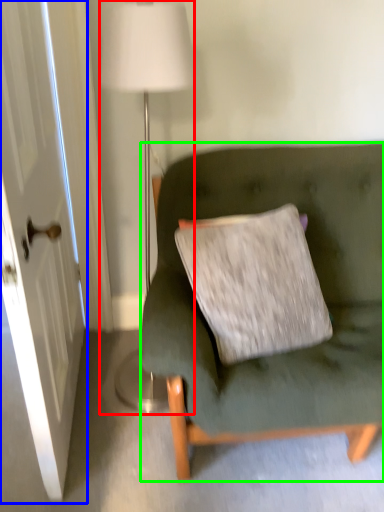
Question: Which object is the farthest from lamp (highlighted by a red box)? Choose among these: door (highlighted by a blue box) or studio couch (highlighted by a green box).

Choices:
 (A) door
 (B) studio couch

Answer: (B)